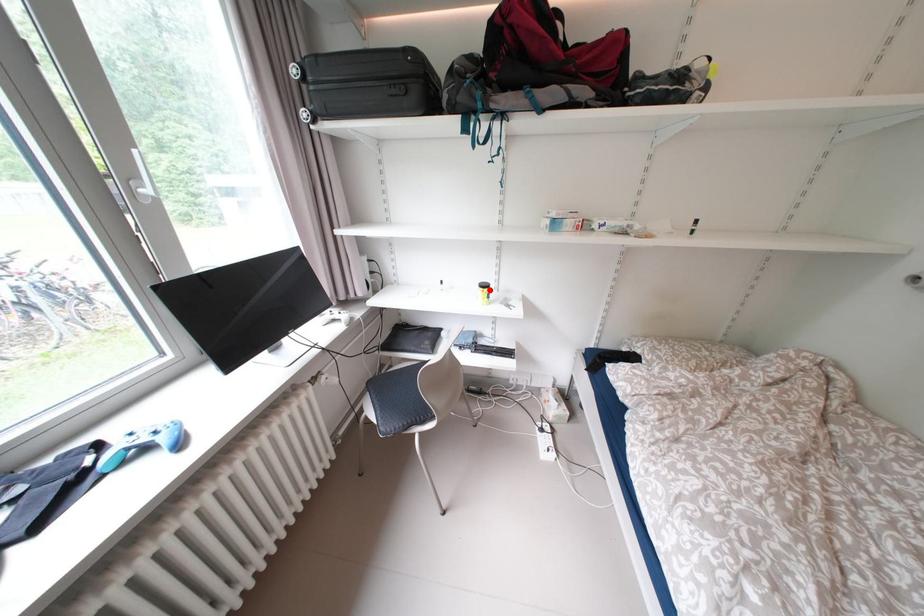
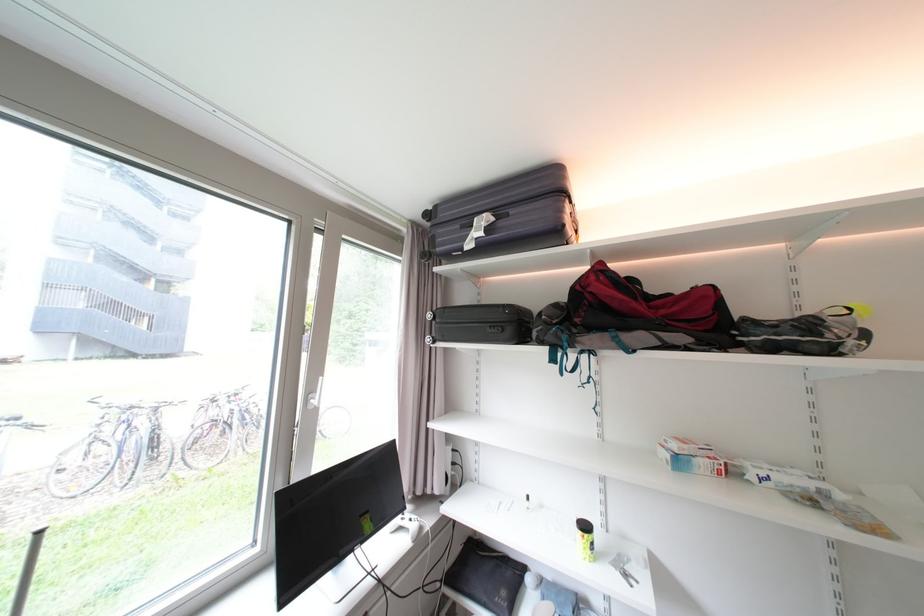
In the second image, find the point that corresponds to the highlighted location in the first image.

(589, 533)